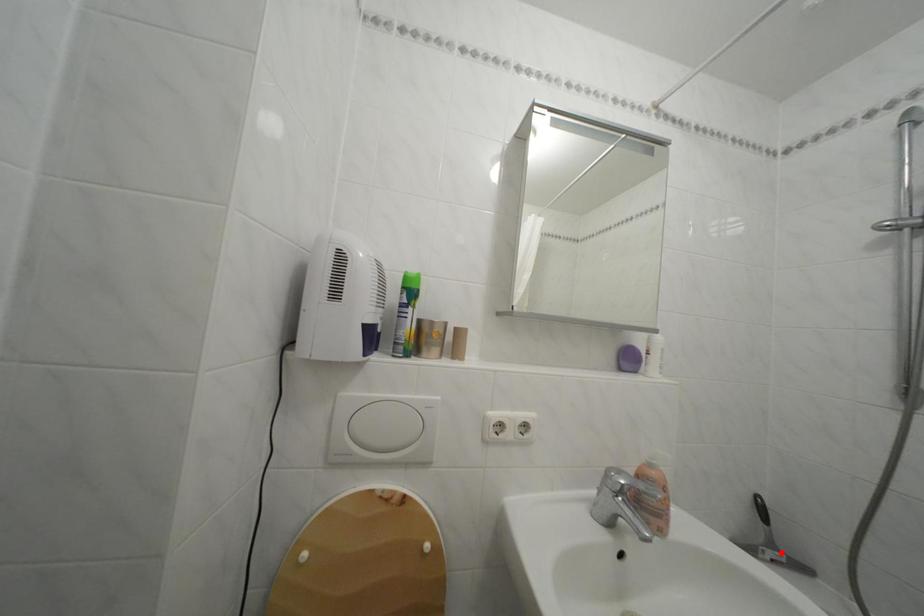
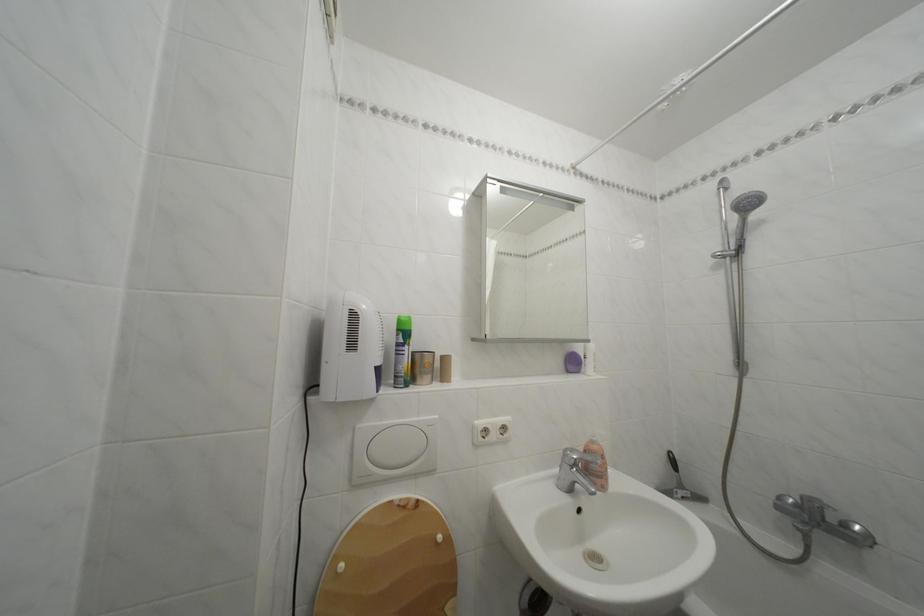
Where in the second image is the point corresponding to the highlighted location from the first image?

(689, 492)